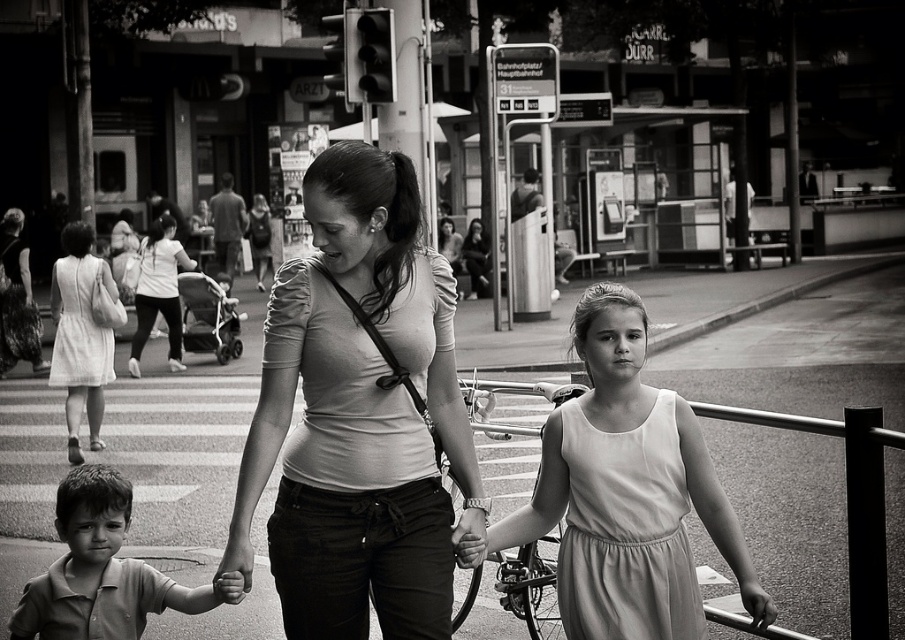
Is light beige fabric dress at center thinner than smooth cotton shirt at lower left?

Correct, light beige fabric dress at center's width is less than smooth cotton shirt at lower left's.

You are a GUI agent. You are given a task and a screenshot of the screen. Output one action in this format:
    pyautogui.click(x=<x>, y=<y>)
    Task: Click on the light beige fabric dress at center
    Image resolution: width=905 pixels, height=640 pixels.
    Given the screenshot: What is the action you would take?
    pyautogui.click(x=624, y=493)

Does matte white shirt at center have a smaller size compared to light beige fabric dress at center?

Yes, matte white shirt at center is smaller than light beige fabric dress at center.

Is matte white shirt at center bigger than light beige fabric dress at center?

Incorrect, matte white shirt at center is not larger than light beige fabric dress at center.

Between point (365, 410) and point (684, 612), which one is positioned behind?

The point (684, 612) is more distant.

The width and height of the screenshot is (905, 640). Identify the location of matte white shirt at center. click(359, 416).

Where is `matte white shirt at center`? Image resolution: width=905 pixels, height=640 pixels. matte white shirt at center is located at coordinates (359, 416).

Who is positioned more to the left, matte white shirt at center or smooth cotton shirt at lower left?

From the viewer's perspective, smooth cotton shirt at lower left appears more on the left side.

Does point (349, 273) lie in front of point (118, 605)?

Yes.

Image resolution: width=905 pixels, height=640 pixels. I want to click on matte white shirt at center, so click(x=359, y=416).